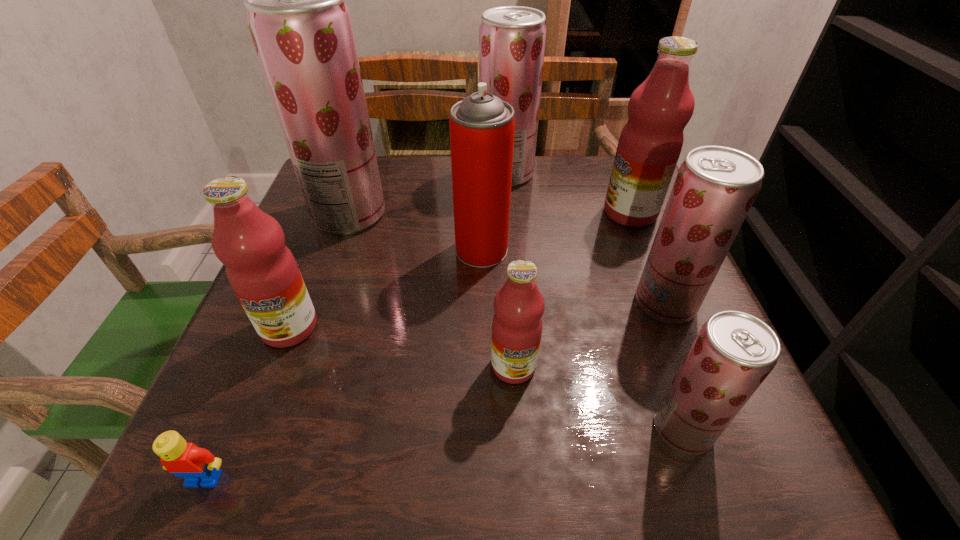
The height and width of the screenshot is (540, 960). Identify the location of object situated at the near right corner. (733, 353).

This screenshot has width=960, height=540. In the image, there is a desktop. Identify the location of free region at the far edge. (540, 181).

This screenshot has height=540, width=960. What are the coordinates of `vacant space at the near edge of the desktop` in the screenshot? It's located at (422, 463).

Identify the location of vacant space at the left edge. (297, 230).

This screenshot has height=540, width=960. Find the location of `vacant space at the right edge of the desktop`. vacant space at the right edge of the desktop is located at coordinates (594, 220).

At what (x,y) coordinates should I click in order to perform the action: click on free space at the near left corner. Please return your answer as a coordinate pair (x, y). The width and height of the screenshot is (960, 540). Looking at the image, I should click on (266, 434).

Identify the location of vacant space in between the rightmost pink fruit juice and the second strawberry fruit juice from left to right. (568, 193).

Where is `empty location between the aerosol can and the smallest strawberry fruit juice`? This screenshot has width=960, height=540. empty location between the aerosol can and the smallest strawberry fruit juice is located at coordinates (582, 340).

The image size is (960, 540). I want to click on empty space that is in between the farthest object and the eighth farthest object, so click(594, 301).

Where is `vacant region between the leftmost strawberry fruit juice and the red aerosol can`? The image size is (960, 540). vacant region between the leftmost strawberry fruit juice and the red aerosol can is located at coordinates (416, 232).